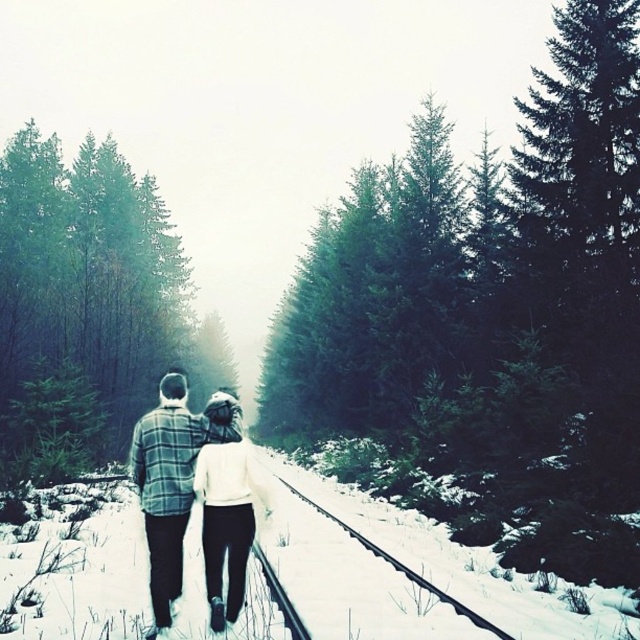
Does green matte tree at center appear under plaid flannel shirt at center?

No, green matte tree at center is not below plaid flannel shirt at center.

Does green matte tree at center lie in front of plaid flannel shirt at center?

No, green matte tree at center is further to the viewer.

What do you see at coordinates (492, 317) in the screenshot? The height and width of the screenshot is (640, 640). I see `green matte tree at center` at bounding box center [492, 317].

At what (x,y) coordinates should I click in order to perform the action: click on green matte tree at center. Please return your answer as a coordinate pair (x, y). Looking at the image, I should click on (492, 317).